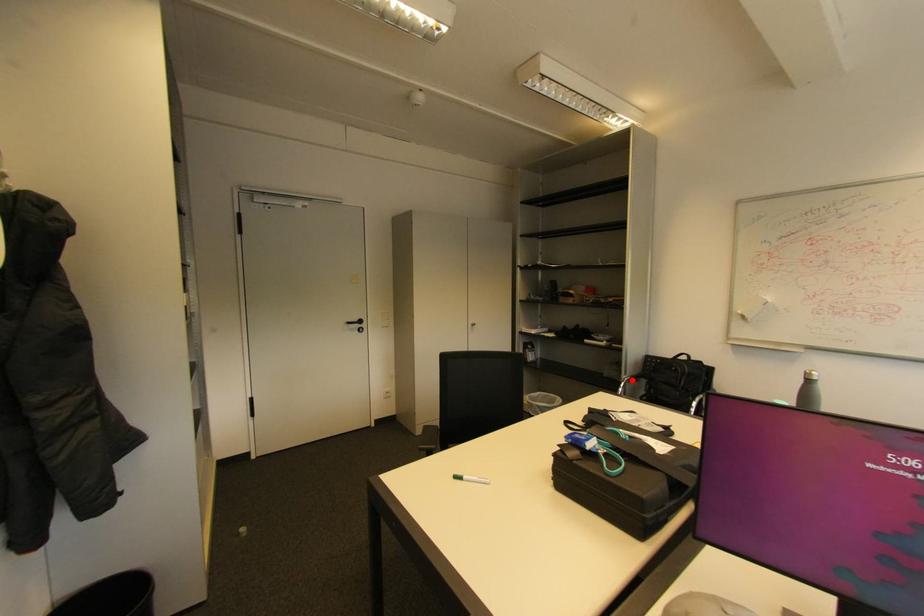
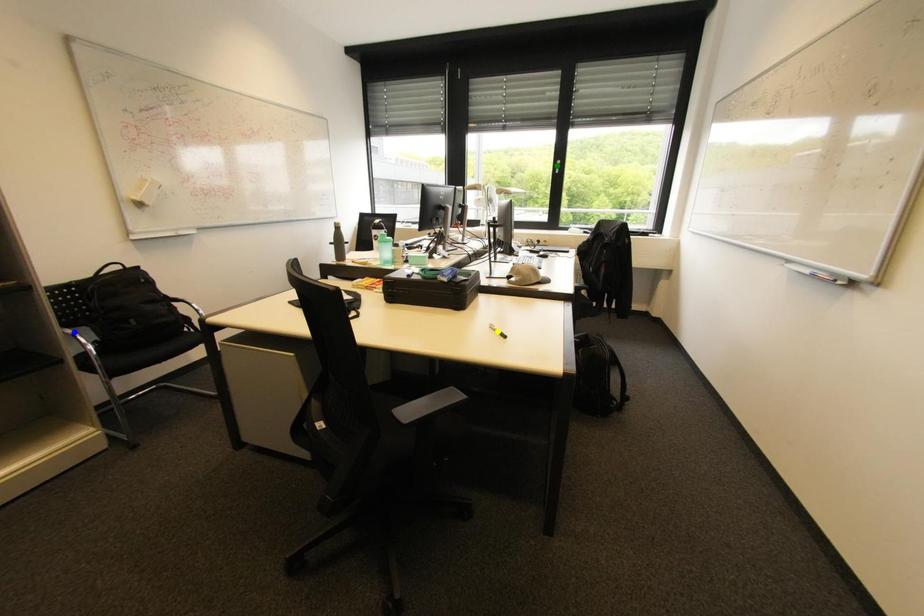
Question: I am providing you with two images of the same scene from different viewpoints. A red point is marked on the first image. You are given multiple points on the second image. Which mark in image 2 goes with the point in image 1?

Choices:
 (A) green point
 (B) blue point
 (C) yellow point

Answer: (B)